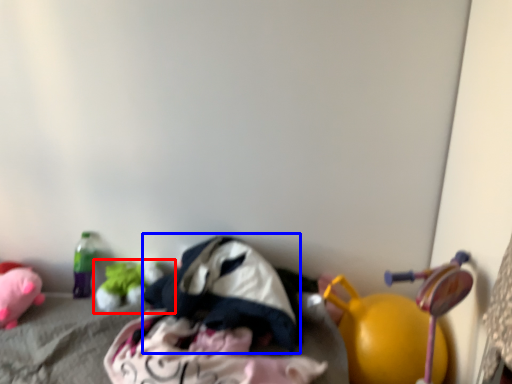
Question: Which object is closer to the camera taking this photo, toy (highlighted by a red box) or clothing (highlighted by a blue box)?

Choices:
 (A) toy
 (B) clothing

Answer: (B)